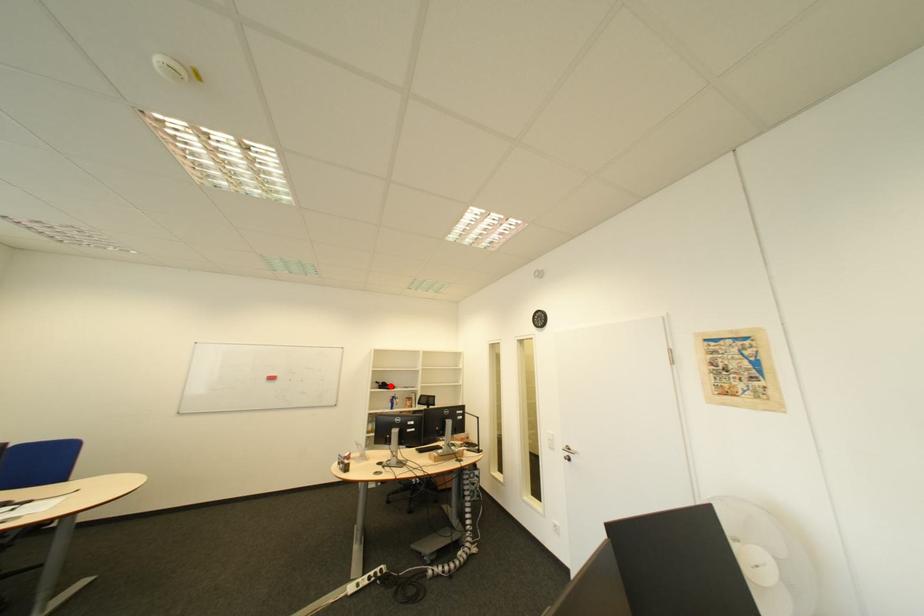
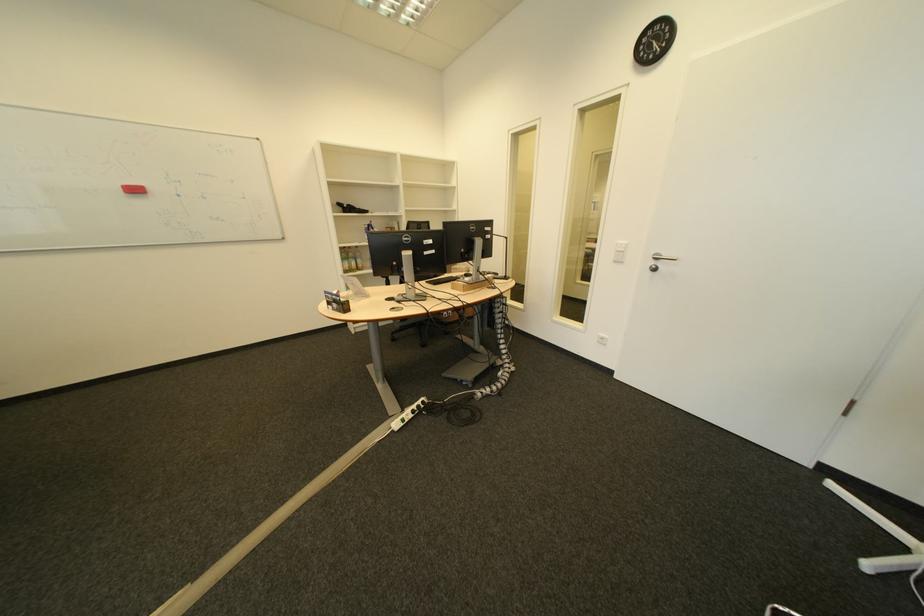
In the second image, find the point that corresponds to the highlighted location in the first image.

(354, 209)